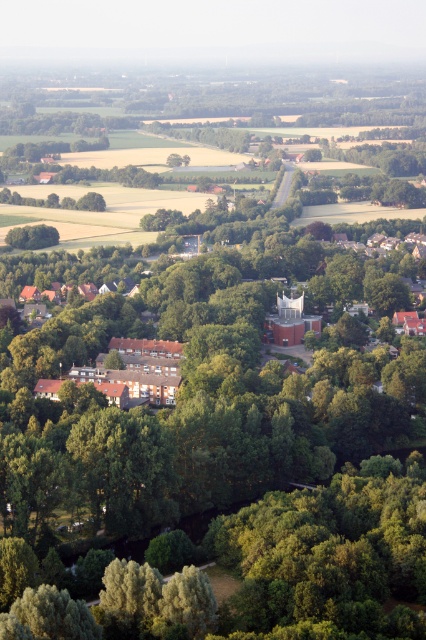
Question: Which point is farther to the camera?

Choices:
 (A) (69, 372)
 (B) (45, 244)

Answer: (B)

Question: Among these points, which one is farthest from the camera?

Choices:
 (A) (6, 236)
 (B) (118, 392)

Answer: (A)

Question: Which point is closer to the camera taking this photo?

Choices:
 (A) coord(43,243)
 (B) coord(114,372)

Answer: (B)

Question: Does brown wooden houses at lower left appear under green leafy tree at lower left?

Choices:
 (A) no
 (B) yes

Answer: (B)

Question: Does brown wooden houses at lower left have a larger size compared to green leafy tree at lower left?

Choices:
 (A) yes
 (B) no

Answer: (A)

Question: Does brown wooden houses at lower left appear on the right side of green leafy tree at lower left?

Choices:
 (A) no
 (B) yes

Answer: (B)